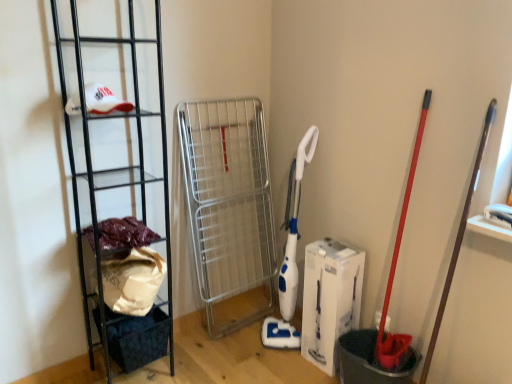
Question: Is white cardboard box at center turned away from dark blue fabric basket at lower left?

Choices:
 (A) yes
 (B) no

Answer: (B)

Question: From a real-world perspective, is white cardboard box at center positioned under dark blue fabric basket at lower left based on gravity?

Choices:
 (A) no
 (B) yes

Answer: (A)

Question: Could dark blue fabric basket at lower left be considered to be inside white cardboard box at center?

Choices:
 (A) yes
 (B) no

Answer: (B)

Question: Considering the relative sizes of white cardboard box at center and dark blue fabric basket at lower left in the image provided, is white cardboard box at center shorter than dark blue fabric basket at lower left?

Choices:
 (A) no
 (B) yes

Answer: (A)

Question: Is white cardboard box at center thinner than dark blue fabric basket at lower left?

Choices:
 (A) no
 (B) yes

Answer: (B)

Question: From a real-world perspective, is fuzzy fabric at left physically located above or below white cardboard box at center?

Choices:
 (A) above
 (B) below

Answer: (A)

Question: Relative to white cardboard box at center, is fuzzy fabric at left in front or behind?

Choices:
 (A) front
 (B) behind

Answer: (A)

Question: Visually, is fuzzy fabric at left positioned to the left or to the right of white cardboard box at center?

Choices:
 (A) right
 (B) left

Answer: (B)

Question: Is fuzzy fabric at left wider or thinner than white cardboard box at center?

Choices:
 (A) wide
 (B) thin

Answer: (A)

Question: Which is correct: black metal rack at left is inside fuzzy fabric at left, or outside of it?

Choices:
 (A) outside
 (B) inside

Answer: (A)

Question: Considering the positions of black metal rack at left and fuzzy fabric at left in the image, is black metal rack at left taller or shorter than fuzzy fabric at left?

Choices:
 (A) short
 (B) tall

Answer: (B)

Question: Relative to fuzzy fabric at left, is black metal rack at left in front or behind?

Choices:
 (A) front
 (B) behind

Answer: (A)

Question: From the image's perspective, is black metal rack at left above or below fuzzy fabric at left?

Choices:
 (A) below
 (B) above

Answer: (B)

Question: From the image's perspective, is fuzzy fabric at left positioned above or below dark blue fabric basket at lower left?

Choices:
 (A) below
 (B) above

Answer: (B)

Question: Considering the positions of fuzzy fabric at left and dark blue fabric basket at lower left in the image, is fuzzy fabric at left wider or thinner than dark blue fabric basket at lower left?

Choices:
 (A) wide
 (B) thin

Answer: (B)